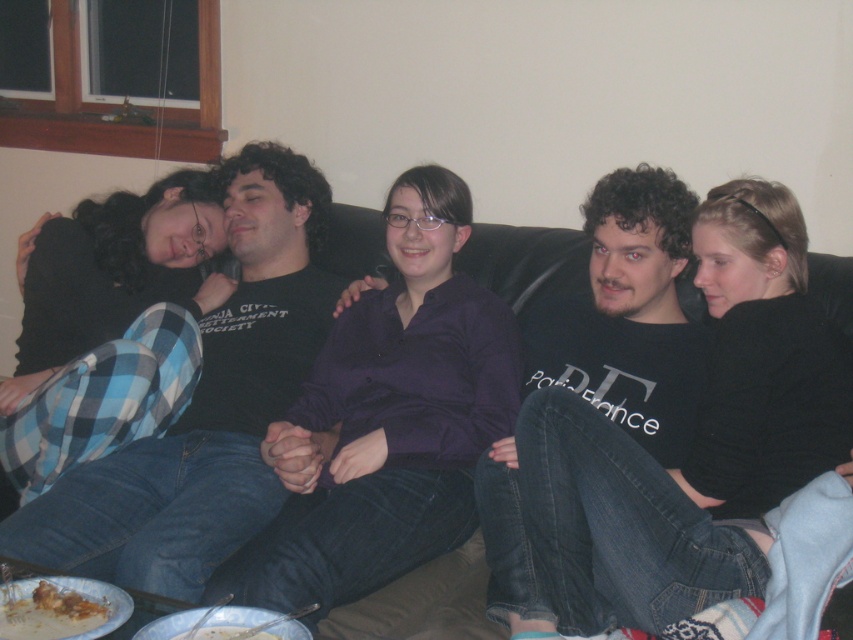
Is point (16, 545) farther from viewer compared to point (216, 630)?

Yes, it is.

At what (x,y) coordinates should I click in order to perform the action: click on black cotton shirt at left. Please return your answer as a coordinate pair (x, y). This screenshot has width=853, height=640. Looking at the image, I should click on (206, 406).

Is point (154, 445) positioned behind point (227, 637)?

That is True.

Identify the location of black cotton shirt at left. (206, 406).

Which is behind, point (289, 264) or point (56, 604)?

The point (289, 264) is more distant.

Can you confirm if black cotton shirt at left is smaller than brown crumbly food at lower left?

Incorrect, black cotton shirt at left is not smaller in size than brown crumbly food at lower left.

Which is behind, point (84, 490) or point (44, 580)?

Positioned behind is point (84, 490).

Locate an element on the screen. This screenshot has height=640, width=853. black cotton shirt at left is located at coordinates (206, 406).

From the picture: Can you confirm if dark gray t-shirt at center is positioned to the right of brown crumbly food at lower left?

Yes, dark gray t-shirt at center is to the right of brown crumbly food at lower left.

Between point (502, 472) and point (99, 605), which one is positioned behind?

The point (502, 472) is more distant.

At what (x,y) coordinates should I click in order to perform the action: click on dark gray t-shirt at center. Please return your answer as a coordinate pair (x, y). The image size is (853, 640). Looking at the image, I should click on (628, 316).